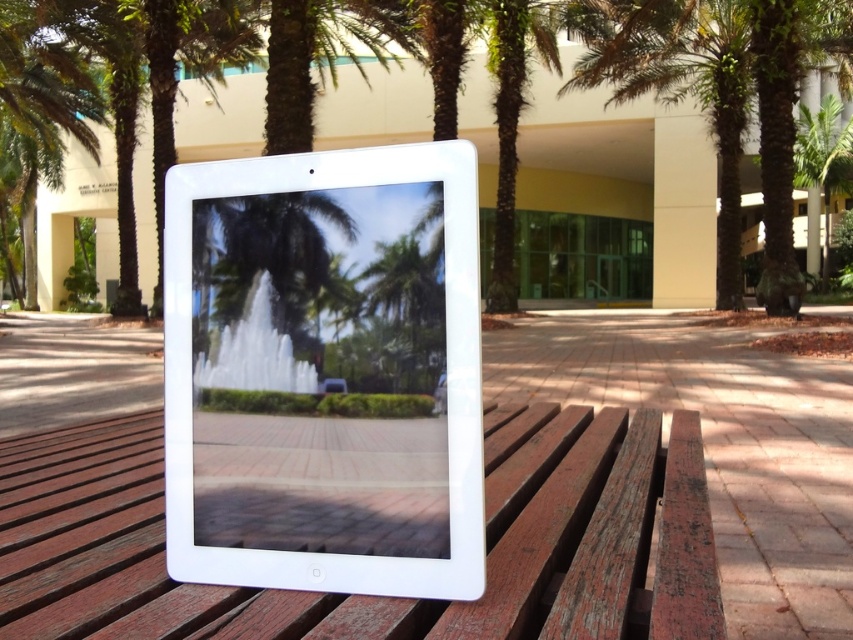
Can you confirm if white glossy tablet at center is smaller than wooden picnic table at center?

Indeed, white glossy tablet at center has a smaller size compared to wooden picnic table at center.

Which is more to the right, white glossy tablet at center or wooden picnic table at center?

Positioned to the right is white glossy tablet at center.

Where is `white glossy tablet at center`? white glossy tablet at center is located at coordinates (325, 371).

Is wooden picnic table at center shorter than green leafy palm tree at upper right?

Correct, wooden picnic table at center is not as tall as green leafy palm tree at upper right.

The image size is (853, 640). What do you see at coordinates (375, 596) in the screenshot? I see `wooden picnic table at center` at bounding box center [375, 596].

Describe the element at coordinates (375, 596) in the screenshot. The width and height of the screenshot is (853, 640). I see `wooden picnic table at center` at that location.

At what (x,y) coordinates should I click in order to perform the action: click on wooden picnic table at center. Please return your answer as a coordinate pair (x, y). Looking at the image, I should click on (375, 596).

Does white glossy tablet at center appear on the right side of green leafy palm tree at upper right?

Incorrect, white glossy tablet at center is not on the right side of green leafy palm tree at upper right.

Between white glossy tablet at center and green leafy palm tree at upper right, which one appears on the left side from the viewer's perspective?

Positioned to the left is white glossy tablet at center.

Which is behind, point (296, 220) or point (849, 141)?

Positioned behind is point (849, 141).

You are a GUI agent. You are given a task and a screenshot of the screen. Output one action in this format:
    pyautogui.click(x=<x>, y=<y>)
    Task: Click on the white glossy tablet at center
    The image size is (853, 640).
    Given the screenshot: What is the action you would take?
    pyautogui.click(x=325, y=371)